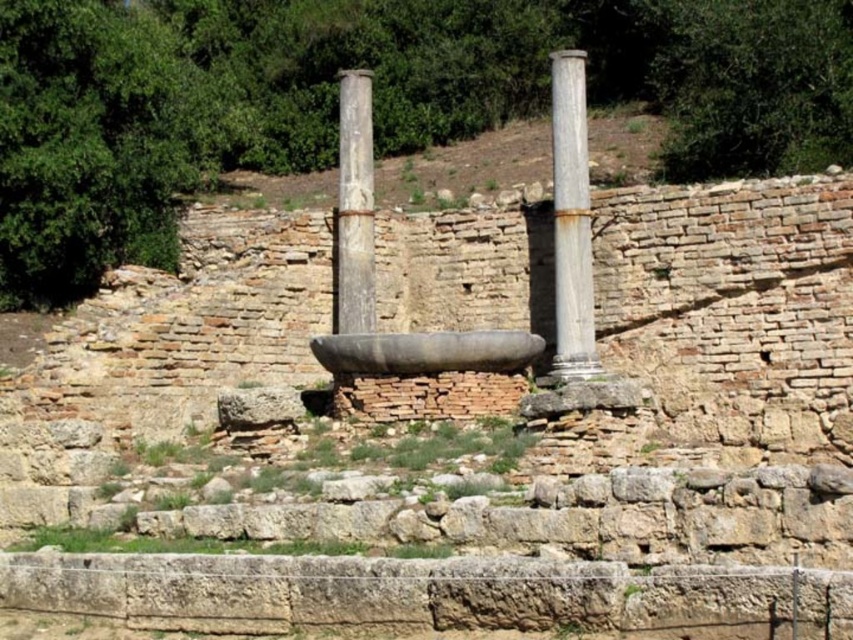
You are an archaeologist examining the ruins. You notice the rusty metallic column at right and the smooth stone column at center. Which column is positioned lower in the scene?

The rusty metallic column at right is positioned lower than the smooth stone column at center.

You are standing in front of the ancient ruins and want to take a photo. You notice two points marked in the scene. Which of the two points, point (552, 371) or point (361, 164), is closer to your camera?

Point (552, 371) is closer to the camera than point (361, 164).